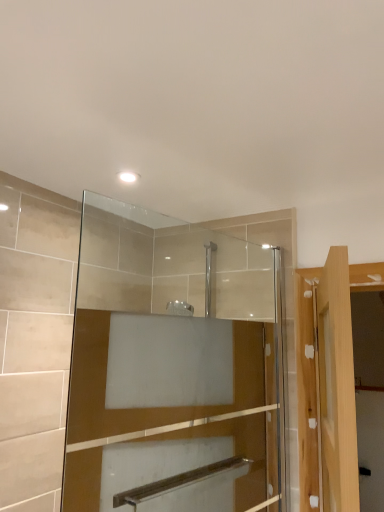
Where is `light wood door at right`? The height and width of the screenshot is (512, 384). light wood door at right is located at coordinates (336, 387).

What do you see at coordinates (336, 387) in the screenshot?
I see `light wood door at right` at bounding box center [336, 387].

Locate an element on the screen. The image size is (384, 512). transparent glass mirror at upper center is located at coordinates (175, 368).

The height and width of the screenshot is (512, 384). What do you see at coordinates (175, 368) in the screenshot?
I see `transparent glass mirror at upper center` at bounding box center [175, 368].

Find the location of a particular element. This screenshot has width=384, height=512. light wood door at right is located at coordinates (336, 387).

Which is more to the left, light wood door at right or transparent glass mirror at upper center?

Positioned to the left is transparent glass mirror at upper center.

Which is behind, light wood door at right or transparent glass mirror at upper center?

transparent glass mirror at upper center is further away from the camera.

Which is behind, point (326, 376) or point (148, 265)?

Point (148, 265)

From the image's perspective, who appears lower, light wood door at right or transparent glass mirror at upper center?

light wood door at right, from the image's perspective.

From a real-world perspective, is light wood door at right on transparent glass mirror at upper center?

No, from a real-world perspective, light wood door at right is not on top of transparent glass mirror at upper center.

Which object is wider, light wood door at right or transparent glass mirror at upper center?

light wood door at right.

Between light wood door at right and transparent glass mirror at upper center, which one has less height?

light wood door at right.

Is light wood door at right bigger than transparent glass mirror at upper center?

Yes, light wood door at right is bigger than transparent glass mirror at upper center.

Is light wood door at right not within transparent glass mirror at upper center?

Yes, light wood door at right is outside of transparent glass mirror at upper center.

Is light wood door at right next to transparent glass mirror at upper center and touching it?

Result: No.

Is light wood door at right oriented away from transparent glass mirror at upper center?

Correct, light wood door at right is looking away from transparent glass mirror at upper center.

How many degrees apart are the facing directions of light wood door at right and transparent glass mirror at upper center?

The angle between the facing direction of light wood door at right and the facing direction of transparent glass mirror at upper center is 27.4 degrees.

How far apart are light wood door at right and transparent glass mirror at upper center?

A distance of 22.47 inches exists between light wood door at right and transparent glass mirror at upper center.

Identify the location of door lying below the transparent glass mirror at upper center (from the image's perspective). The width and height of the screenshot is (384, 512). (336, 387).

Is transparent glass mirror at upper center to the right of light wood door at right from the viewer's perspective?

Incorrect, transparent glass mirror at upper center is not on the right side of light wood door at right.

Considering the relative positions of transparent glass mirror at upper center and light wood door at right in the image provided, is transparent glass mirror at upper center in front of light wood door at right?

No, transparent glass mirror at upper center is behind light wood door at right.

Is point (112, 389) positioned before point (330, 468)?

That is False.

From the image's perspective, who appears lower, transparent glass mirror at upper center or light wood door at right?

light wood door at right.

From a real-world perspective, between transparent glass mirror at upper center and light wood door at right, who is vertically higher?

From a 3D spatial view, transparent glass mirror at upper center is above.

Which object is wider, transparent glass mirror at upper center or light wood door at right?

light wood door at right is wider.

Does transparent glass mirror at upper center have a greater height compared to light wood door at right?

Yes.

Can you confirm if transparent glass mirror at upper center is bigger than light wood door at right?

Actually, transparent glass mirror at upper center might be smaller than light wood door at right.

Is transparent glass mirror at upper center surrounding light wood door at right?

No, light wood door at right is not surrounded by transparent glass mirror at upper center.

Are transparent glass mirror at upper center and light wood door at right beside each other?

They are not placed beside each other.

Is light wood door at right at the back of transparent glass mirror at upper center?

Yes, transparent glass mirror at upper center is facing away from light wood door at right.

How distant is transparent glass mirror at upper center from light wood door at right?

transparent glass mirror at upper center is 22.47 inches away from light wood door at right.

Find the location of a particular element. Image resolution: width=384 pixels, height=512 pixels. mirror above the light wood door at right (from a real-world perspective) is located at coordinates (175, 368).

Image resolution: width=384 pixels, height=512 pixels. I want to click on mirror that is on the left side of light wood door at right, so click(x=175, y=368).

Locate an element on the screen. This screenshot has width=384, height=512. mirror behind the light wood door at right is located at coordinates (175, 368).